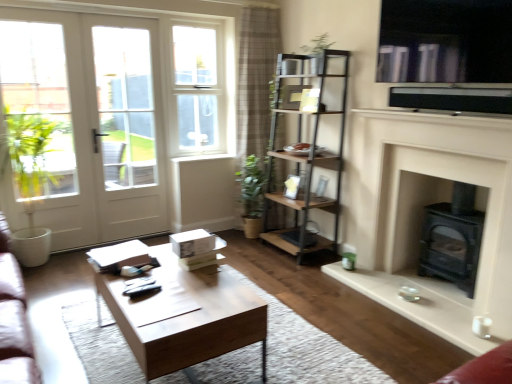
Where is `vacant area situated to the left side of white matte fireplace at right`? Image resolution: width=512 pixels, height=384 pixels. vacant area situated to the left side of white matte fireplace at right is located at coordinates (339, 307).